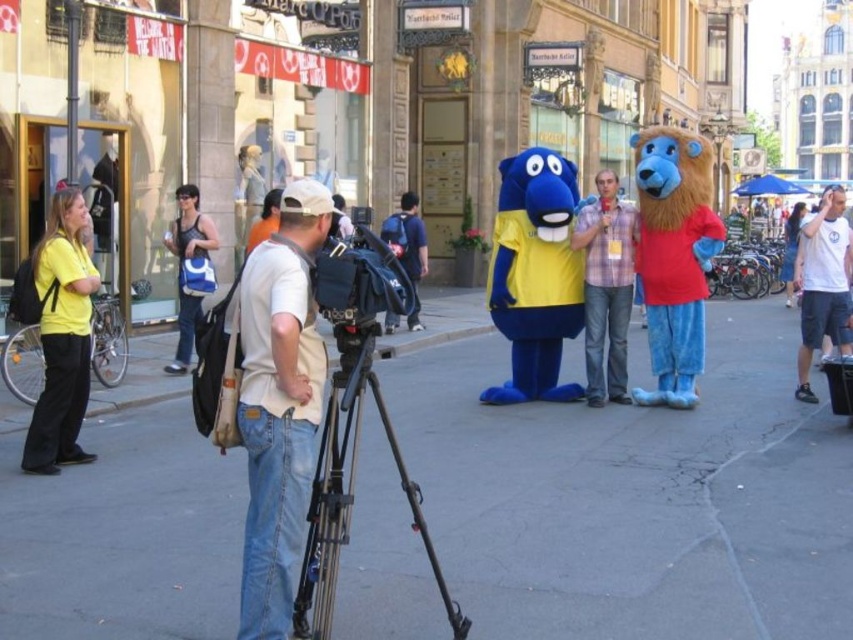
You are a photographer trying to position your camera to capture the blue bear mascot and the lion mascot in the same frame. The camera is mounted on a black matte tripod at center. Where should you place the camera so that the point at coordinates point (350, 488) is centered in the frame?

The point at coordinates point (350, 488) is on the black matte tripod at center, so you should center the camera on the black matte tripod at center to include the point in the frame.

You are a photographer standing at the edge of the scene and want to take a photo of the black matte tripod at center and the plaid shirt at center. If your camera has a maximum focus range of 6 meters, will both subjects be in focus?

The black matte tripod at center is 6.12 meters from plaid shirt at center. However, the question is about the distance from the photographer to each subject, not between them. The provided information does not specify the distance from the photographer to either subject, so it is impossible to determine if they are within the 6 meter focus range.